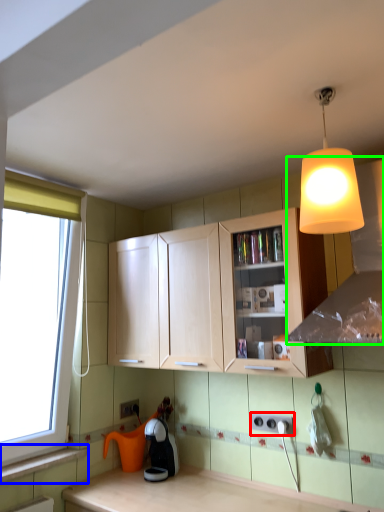
Question: Considering the real-world distances, which object is closest to electric outlet (highlighted by a red box)? window sill (highlighted by a blue box) or exhaust hood (highlighted by a green box).

Choices:
 (A) window sill
 (B) exhaust hood

Answer: (B)